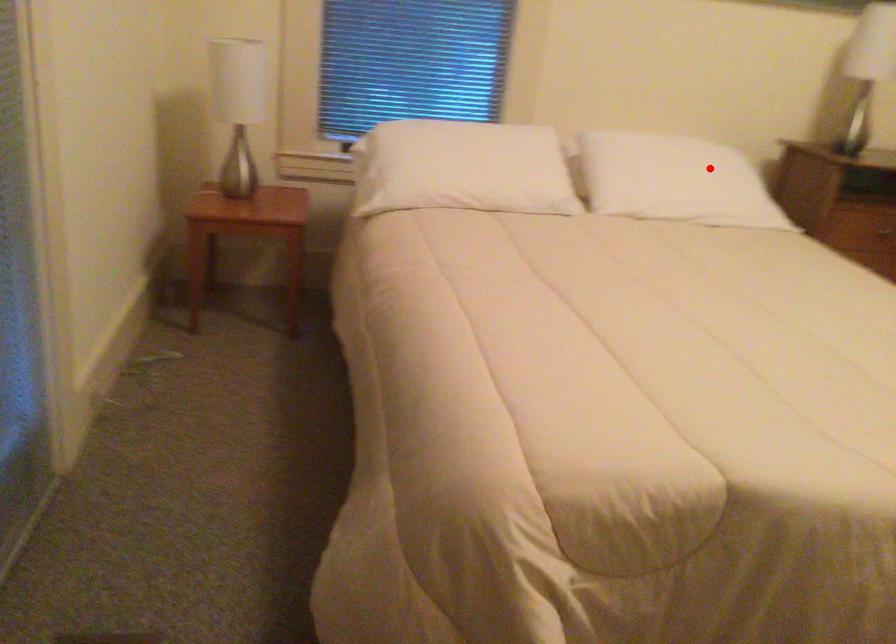
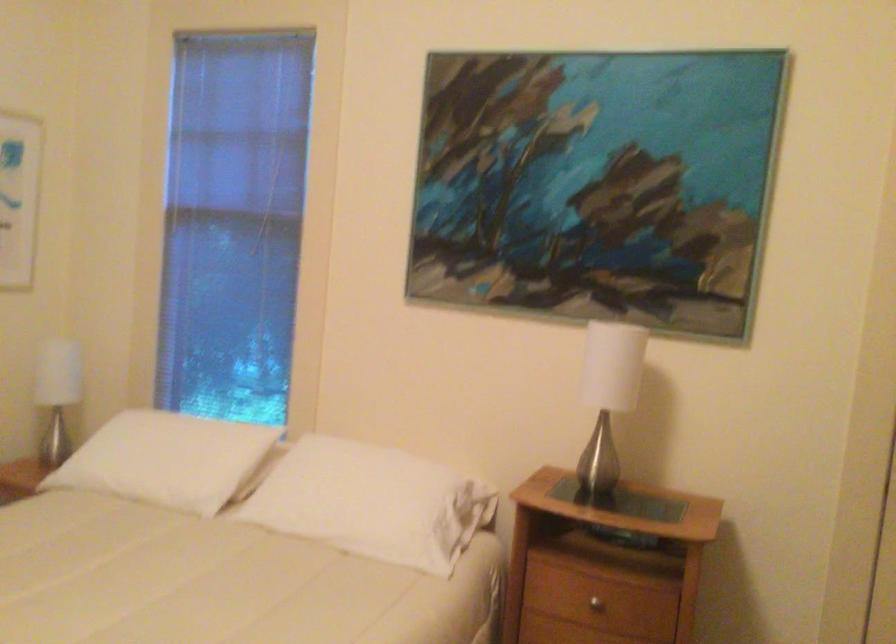
Question: I am providing you with two images of the same scene from different viewpoints. In image1, a red point is highlighted. Considering the same 3D point in image2, which of the following is correct?

Choices:
 (A) It is closer
 (B) It is farther

Answer: (A)